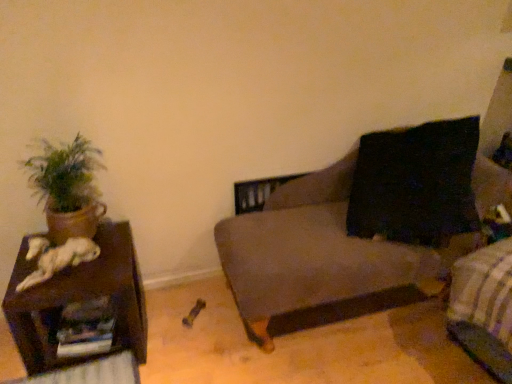
Question: Can you confirm if green matte plant at left is smaller than brown wooden side table at left?

Choices:
 (A) yes
 (B) no

Answer: (A)

Question: Is green matte plant at left at the left side of brown wooden side table at left?

Choices:
 (A) yes
 (B) no

Answer: (A)

Question: From a real-world perspective, is green matte plant at left positioned over brown wooden side table at left based on gravity?

Choices:
 (A) yes
 (B) no

Answer: (A)

Question: Is green matte plant at left taller than brown wooden side table at left?

Choices:
 (A) no
 (B) yes

Answer: (B)

Question: From the image's perspective, is green matte plant at left located above brown wooden side table at left?

Choices:
 (A) no
 (B) yes

Answer: (B)

Question: Considering the positions of brown wooden side table at left and green matte plant at left in the image, is brown wooden side table at left wider or thinner than green matte plant at left?

Choices:
 (A) wide
 (B) thin

Answer: (A)

Question: From the image's perspective, is brown wooden side table at left above or below green matte plant at left?

Choices:
 (A) below
 (B) above

Answer: (A)

Question: From a real-world perspective, is brown wooden side table at left above or below green matte plant at left?

Choices:
 (A) below
 (B) above

Answer: (A)

Question: Considering the positions of point (77, 299) and point (62, 226), is point (77, 299) closer or farther from the camera than point (62, 226)?

Choices:
 (A) closer
 (B) farther

Answer: (A)

Question: Is green matte plant at left inside the boundaries of dark brown fabric bed frame at lower right, or outside?

Choices:
 (A) outside
 (B) inside

Answer: (A)

Question: Is point (84, 155) closer or farther from the camera than point (476, 317)?

Choices:
 (A) farther
 (B) closer

Answer: (A)

Question: From a real-world perspective, is green matte plant at left positioned above or below dark brown fabric bed frame at lower right?

Choices:
 (A) above
 (B) below

Answer: (A)

Question: Considering the positions of green matte plant at left and dark brown fabric bed frame at lower right in the image, is green matte plant at left taller or shorter than dark brown fabric bed frame at lower right?

Choices:
 (A) tall
 (B) short

Answer: (B)

Question: Is brown wooden side table at left wider or thinner than dark gray fabric couch at center?

Choices:
 (A) thin
 (B) wide

Answer: (A)

Question: Based on their positions, is brown wooden side table at left located to the left or right of dark gray fabric couch at center?

Choices:
 (A) left
 (B) right

Answer: (A)